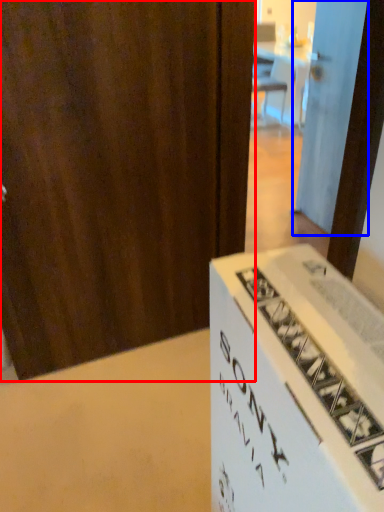
Question: Which of the following is the farthest to the observer, door (highlighted by a red box) or door (highlighted by a blue box)?

Choices:
 (A) door
 (B) door

Answer: (B)